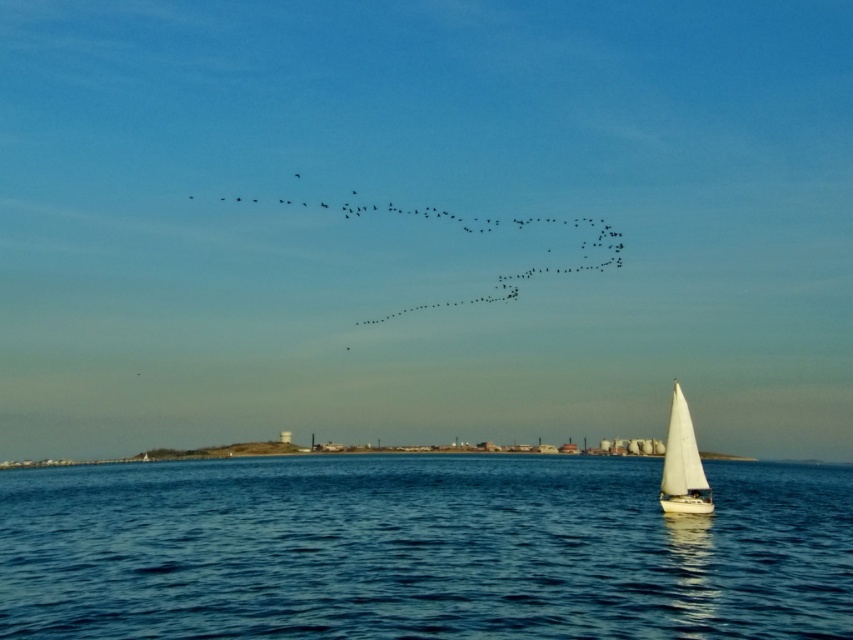
Does black matte birds at upper center lie behind white sailboat at lower right?

Yes, black matte birds at upper center is further from the viewer.

Between black matte birds at upper center and white sailboat at lower right, which one has more height?

Standing taller between the two is black matte birds at upper center.

Which is in front, point (525, 225) or point (670, 499)?

Point (670, 499) is more forward.

I want to click on black matte birds at upper center, so click(480, 234).

Does point (323, 548) lie in front of point (262, 200)?

Yes.

Can you confirm if blue water at center is bigger than black matte birds at upper center?

Yes, blue water at center is bigger than black matte birds at upper center.

Is point (316, 593) closer to viewer compared to point (619, 240)?

That is True.

Locate an element on the screen. blue water at center is located at coordinates (421, 548).

Where is `blue water at center`? The height and width of the screenshot is (640, 853). blue water at center is located at coordinates (421, 548).

Between point (335, 582) and point (672, 483), which one is positioned in front?

Point (335, 582) is in front.

Image resolution: width=853 pixels, height=640 pixels. I want to click on blue water at center, so click(x=421, y=548).